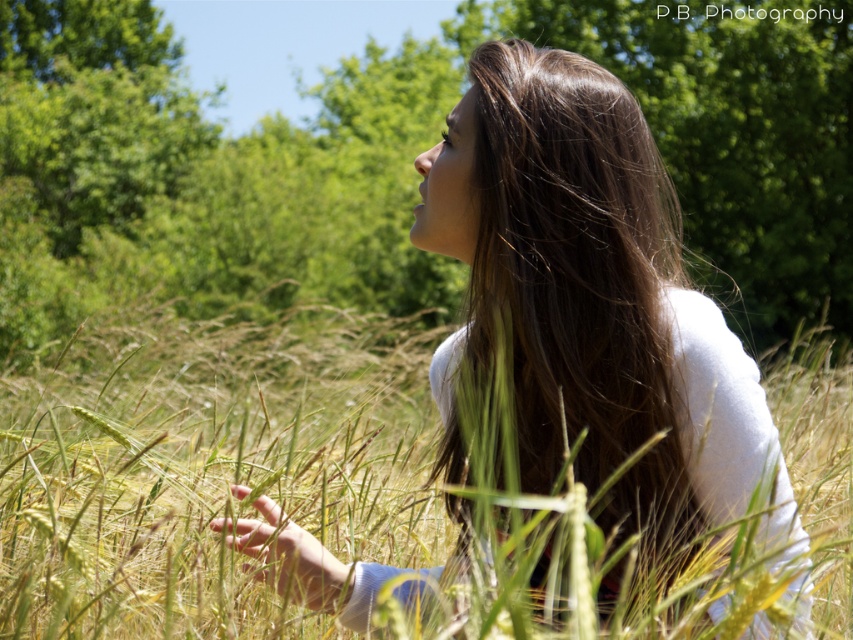
Can you confirm if yellow-green grass at center is wider than brown silky hair at center?

Yes.

Is point (421, 369) positioned after point (672, 429)?

That is True.

Who is more distant from viewer, (84, 417) or (535, 448)?

Point (84, 417)

The image size is (853, 640). I want to click on yellow-green grass at center, so click(207, 467).

Is point (234, 397) positioned in front of point (473, 218)?

No.

Consider the image. Does yellow-green grass at center have a greater height compared to white soft fabric at center?

Indeed, yellow-green grass at center has a greater height compared to white soft fabric at center.

I want to click on yellow-green grass at center, so click(207, 467).

Which is more to the left, white soft fabric at center or brown silky hair at center?

From the viewer's perspective, white soft fabric at center appears more on the left side.

Who is more forward, [521,465] or [576,340]?

Point [576,340] is more forward.

Which is behind, point (489, 337) or point (583, 209)?

The point (489, 337) is more distant.

Where is `white soft fabric at center`? white soft fabric at center is located at coordinates (x=592, y=310).